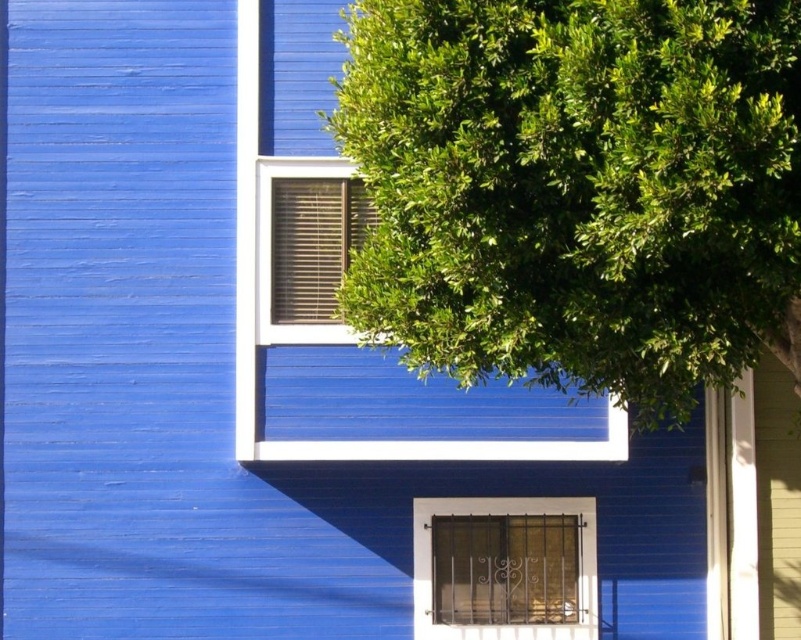
Is metallic gold window at lower center to the right of matte brown blinds at upper center from the viewer's perspective?

Yes, metallic gold window at lower center is to the right of matte brown blinds at upper center.

Find the location of a particular element. metallic gold window at lower center is located at coordinates (504, 568).

Find the location of `metallic gold window at lower center`. metallic gold window at lower center is located at coordinates (504, 568).

Is green leafy tree at upper right to the right of metallic gold window at lower center from the viewer's perspective?

Indeed, green leafy tree at upper right is positioned on the right side of metallic gold window at lower center.

Describe the element at coordinates (578, 189) in the screenshot. Image resolution: width=801 pixels, height=640 pixels. I see `green leafy tree at upper right` at that location.

What do you see at coordinates (578, 189) in the screenshot?
I see `green leafy tree at upper right` at bounding box center [578, 189].

Locate an element on the screen. This screenshot has width=801, height=640. green leafy tree at upper right is located at coordinates (578, 189).

Based on the photo, which is below, green leafy tree at upper right or matte brown blinds at upper center?

matte brown blinds at upper center is lower down.

Which is more to the right, green leafy tree at upper right or matte brown blinds at upper center?

green leafy tree at upper right

Is point (715, 40) less distant than point (270, 253)?

Yes, point (715, 40) is closer to viewer.

Identify the location of green leafy tree at upper right. This screenshot has width=801, height=640. (578, 189).